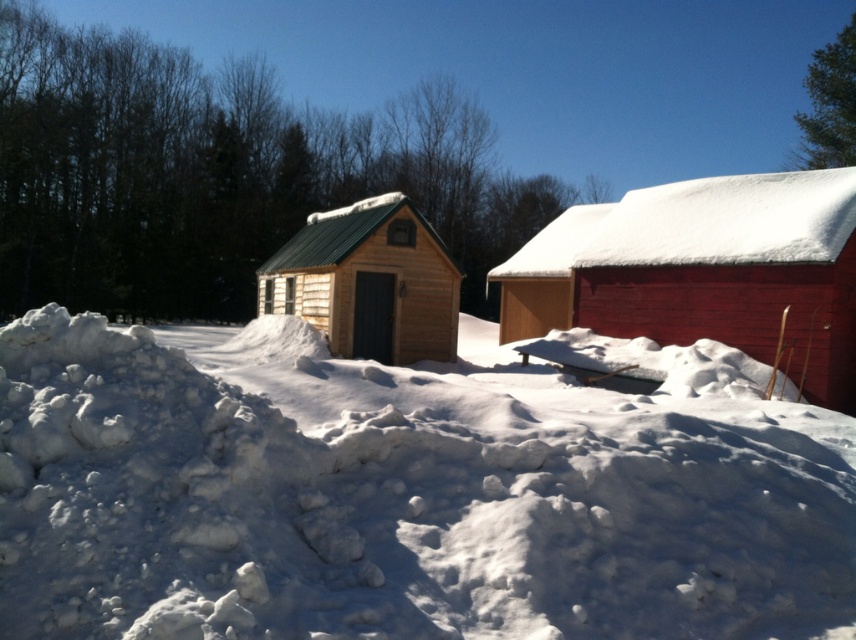
Does smooth red barn at right have a smaller size compared to natural wood cabin at center?

Actually, smooth red barn at right might be larger than natural wood cabin at center.

This screenshot has height=640, width=856. What do you see at coordinates (703, 269) in the screenshot?
I see `smooth red barn at right` at bounding box center [703, 269].

This screenshot has height=640, width=856. Find the location of `smooth red barn at right`. smooth red barn at right is located at coordinates (703, 269).

Is white fluffy snow at center wider than smooth red barn at right?

Yes.

Who is taller, white fluffy snow at center or smooth red barn at right?

With more height is smooth red barn at right.

This screenshot has height=640, width=856. Find the location of `white fluffy snow at center`. white fluffy snow at center is located at coordinates (406, 492).

Who is lower down, white fluffy snow at center or natural wood cabin at center?

Positioned lower is white fluffy snow at center.

Is white fluffy snow at center bigger than natural wood cabin at center?

Correct, white fluffy snow at center is larger in size than natural wood cabin at center.

This screenshot has width=856, height=640. In order to click on white fluffy snow at center in this screenshot , I will do `click(406, 492)`.

The width and height of the screenshot is (856, 640). What are the coordinates of `white fluffy snow at center` in the screenshot? It's located at (406, 492).